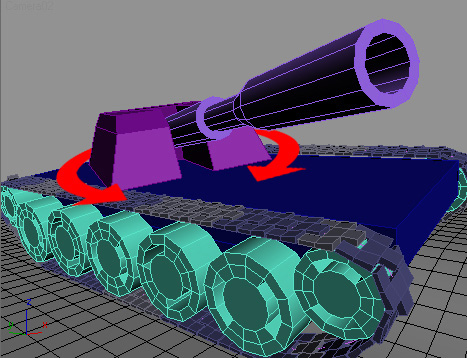
Where is `tiled floor`? This screenshot has height=358, width=467. tiled floor is located at coordinates (115, 329).